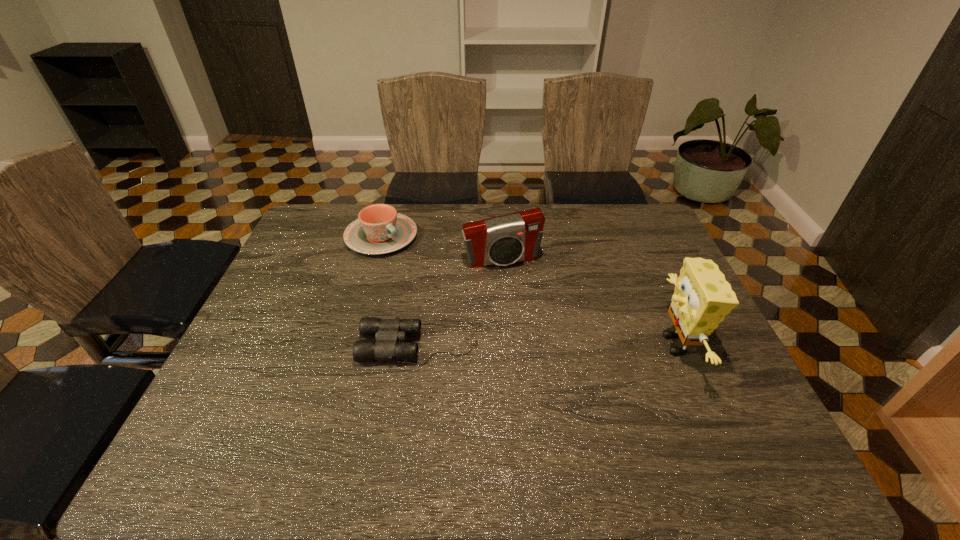
Find the location of a particular element. object located at the right edge is located at coordinates (702, 298).

Locate an element on the screen. This screenshot has width=960, height=540. object at the far left corner is located at coordinates (379, 229).

Where is `object at the near right corner`? object at the near right corner is located at coordinates (702, 298).

Identify the location of free space at the far edge. The height and width of the screenshot is (540, 960). (433, 237).

Image resolution: width=960 pixels, height=540 pixels. Find the location of `vacant space at the near edge`. vacant space at the near edge is located at coordinates (637, 399).

In the image, there is a desktop. At what (x,y) coordinates should I click in order to perform the action: click on vacant space at the left edge. Please return your answer as a coordinate pair (x, y). Looking at the image, I should click on (267, 342).

Image resolution: width=960 pixels, height=540 pixels. Find the location of `vacant region at the right edge of the desktop`. vacant region at the right edge of the desktop is located at coordinates (662, 264).

In order to click on vacant space at the near left corner of the desktop in this screenshot , I will do `click(254, 397)`.

The height and width of the screenshot is (540, 960). In the image, there is a desktop. What are the coordinates of `free space at the far right corner` in the screenshot? It's located at (640, 206).

Find the location of a particular element. free space between the chinaware and the binoculars is located at coordinates (400, 291).